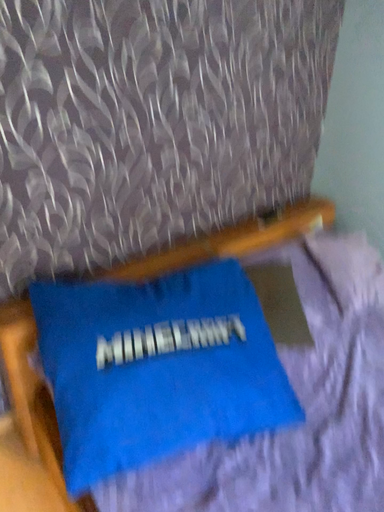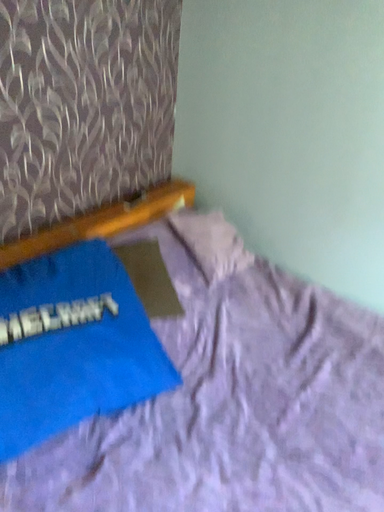
Question: How did the camera likely rotate when shooting the video?

Choices:
 (A) rotated right
 (B) rotated left

Answer: (A)